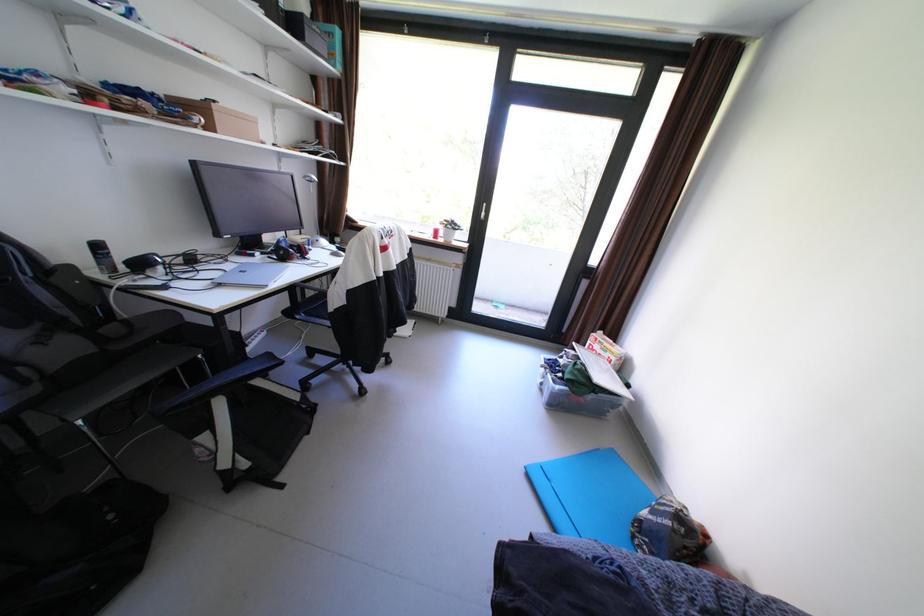
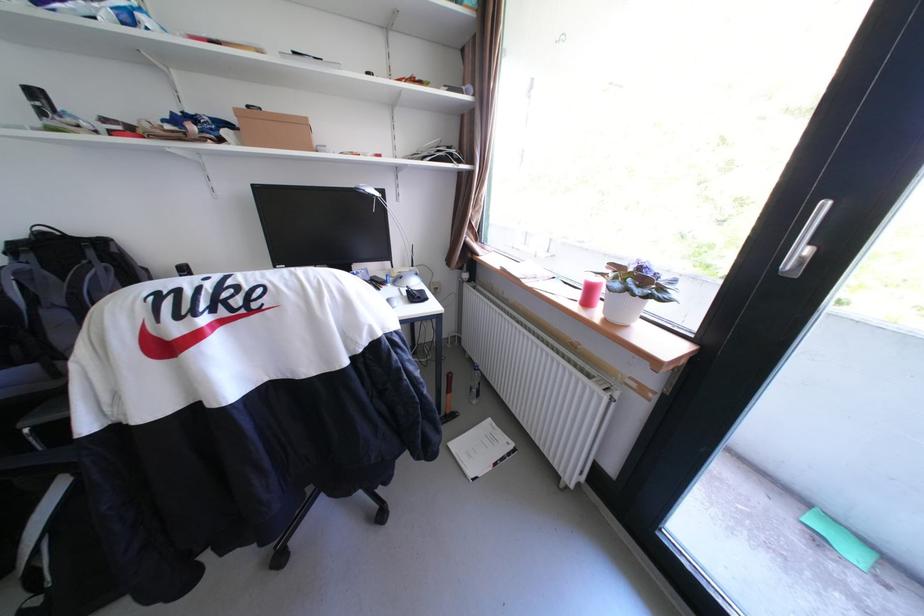
Question: I am providing you with two images of the same scene from different viewpoints. Please identify which objects are invisible in image2.

Choices:
 (A) black spray can
 (B) hammer
 (C) red candle
 (D) pink flip-flop

Answer: (A)